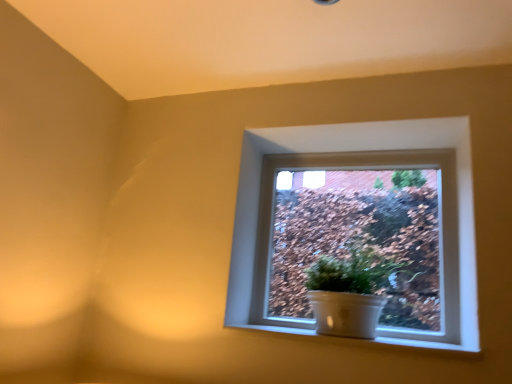
Question: Is white glossy pot at center not close to white ceramic at lower center?

Choices:
 (A) no
 (B) yes

Answer: (A)

Question: Is white glossy pot at center at the left side of white ceramic at lower center?

Choices:
 (A) no
 (B) yes

Answer: (A)

Question: Is white ceramic at lower center inside white glossy pot at center?

Choices:
 (A) yes
 (B) no

Answer: (B)

Question: Is white glossy pot at center located outside white ceramic at lower center?

Choices:
 (A) no
 (B) yes

Answer: (B)

Question: Is white glossy pot at center directly adjacent to white ceramic at lower center?

Choices:
 (A) no
 (B) yes

Answer: (A)

Question: Is white glossy pot at center facing away from white ceramic at lower center?

Choices:
 (A) yes
 (B) no

Answer: (B)

Question: Is white ceramic at lower center shorter than white glossy pot at center?

Choices:
 (A) no
 (B) yes

Answer: (B)

Question: Does white ceramic at lower center have a lesser width compared to white glossy pot at center?

Choices:
 (A) no
 (B) yes

Answer: (A)

Question: From a real-world perspective, is white ceramic at lower center under white glossy pot at center?

Choices:
 (A) no
 (B) yes

Answer: (B)

Question: Can white glossy pot at center be found inside white ceramic at lower center?

Choices:
 (A) no
 (B) yes

Answer: (A)

Question: Is the surface of white ceramic at lower center in direct contact with white glossy pot at center?

Choices:
 (A) yes
 (B) no

Answer: (B)

Question: Can you confirm if white ceramic at lower center is positioned to the left of white glossy pot at center?

Choices:
 (A) no
 (B) yes

Answer: (B)

Question: From a real-world perspective, is white ceramic at lower center over white ceramic pot at center?

Choices:
 (A) no
 (B) yes

Answer: (A)